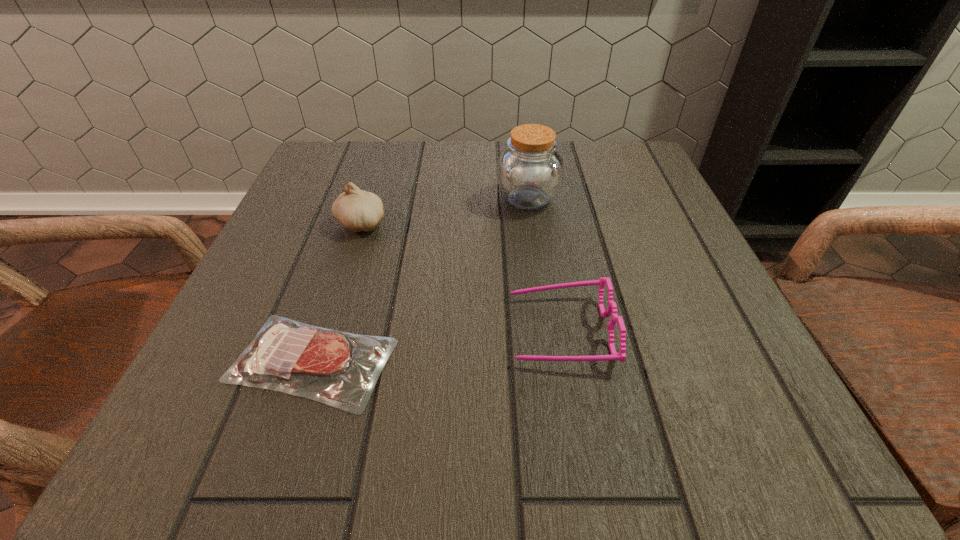
Where is `object at the far edge`? object at the far edge is located at coordinates (530, 170).

Image resolution: width=960 pixels, height=540 pixels. In order to click on object that is positioned at the near edge in this screenshot , I will do `click(286, 355)`.

You are a GUI agent. You are given a task and a screenshot of the screen. Output one action in this format:
    pyautogui.click(x=<x>, y=<y>)
    Task: Click on the garlic that is positioned at the left edge
    
    Given the screenshot: What is the action you would take?
    pyautogui.click(x=358, y=210)

Where is `steak that is at the left edge`? The width and height of the screenshot is (960, 540). steak that is at the left edge is located at coordinates (286, 355).

Locate an element on the screen. object at the near left corner is located at coordinates (286, 355).

What are the coordinates of `free space at the far edge of the desktop` in the screenshot? It's located at (416, 174).

In the image, there is a desktop. Identify the location of free space at the near edge. The width and height of the screenshot is (960, 540). (371, 417).

Find the location of a particular element. This screenshot has height=540, width=960. free space at the left edge of the desktop is located at coordinates (300, 208).

This screenshot has width=960, height=540. I want to click on vacant space at the right edge of the desktop, so click(700, 394).

In the image, there is a desktop. What are the coordinates of `free space at the far left corner` in the screenshot? It's located at (380, 155).